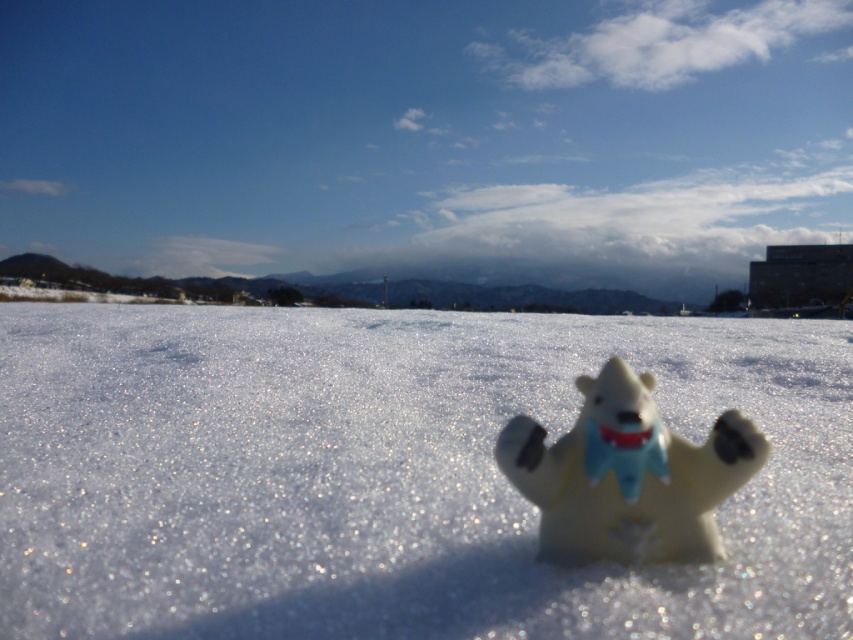
Question: Does white matte snow at center lie behind white plastic bear at center?

Choices:
 (A) yes
 (B) no

Answer: (B)

Question: Is white matte snow at center in front of white plastic bear at center?

Choices:
 (A) no
 (B) yes

Answer: (B)

Question: Is white matte snow at center positioned in front of white plastic bear at center?

Choices:
 (A) no
 (B) yes

Answer: (B)

Question: Which of the following is the farthest from the observer?

Choices:
 (A) (462, 596)
 (B) (612, 493)

Answer: (B)